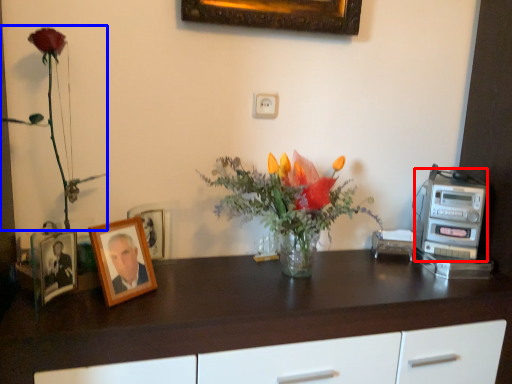
Question: Which object is closer to the camera taking this photo, appliance (highlighted by a red box) or floral arrangement (highlighted by a blue box)?

Choices:
 (A) appliance
 (B) floral arrangement

Answer: (B)